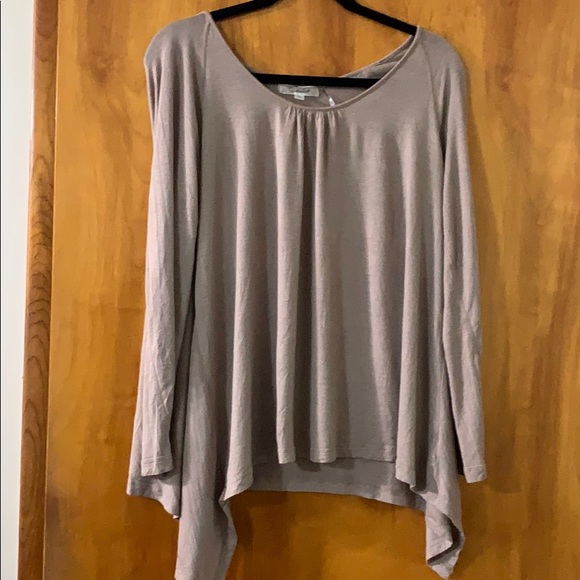
This screenshot has width=580, height=580. I want to click on black handle, so click(366, 14).